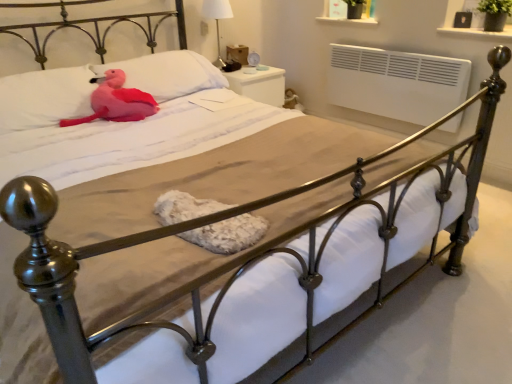
Question: From a real-world perspective, is matte pink pillow at upper left, which is the 1th pillow from right to left, beneath pink plush at upper left, which appears as the 1th pillow when viewed from the left?

Choices:
 (A) no
 (B) yes

Answer: (B)

Question: From the image's perspective, is matte pink pillow at upper left, which is the 1th pillow from right to left, under pink plush at upper left, which appears as the 1th pillow when viewed from the left?

Choices:
 (A) yes
 (B) no

Answer: (B)

Question: From the image's perspective, would you say matte pink pillow at upper left, which is the 1th pillow from right to left, is positioned over pink plush at upper left, the 2th pillow when ordered from right to left?

Choices:
 (A) no
 (B) yes

Answer: (B)

Question: Could you tell me if matte pink pillow at upper left, which is the 1th pillow from right to left, is facing pink plush at upper left, the 2th pillow when ordered from right to left?

Choices:
 (A) no
 (B) yes

Answer: (A)

Question: Can you confirm if matte pink pillow at upper left, acting as the 2th pillow starting from the left, is wider than pink plush at upper left, the 2th pillow when ordered from right to left?

Choices:
 (A) no
 (B) yes

Answer: (B)

Question: From a real-world perspective, is pink plush toy at upper left physically located above or below pink plush at upper left, which appears as the 1th pillow when viewed from the left?

Choices:
 (A) below
 (B) above

Answer: (A)

Question: Is pink plush toy at upper left taller or shorter than pink plush at upper left, which appears as the 1th pillow when viewed from the left?

Choices:
 (A) short
 (B) tall

Answer: (A)

Question: Is pink plush toy at upper left spatially inside pink plush at upper left, which appears as the 1th pillow when viewed from the left, or outside of it?

Choices:
 (A) outside
 (B) inside

Answer: (B)

Question: Is pink plush toy at upper left in front of or behind pink plush at upper left, the 2th pillow when ordered from right to left, in the image?

Choices:
 (A) behind
 (B) front

Answer: (A)

Question: Is white fabric lampshade at upper center wider or thinner than white glossy nightstand at upper right?

Choices:
 (A) wide
 (B) thin

Answer: (B)

Question: From their relative heights in the image, would you say white fabric lampshade at upper center is taller or shorter than white glossy nightstand at upper right?

Choices:
 (A) short
 (B) tall

Answer: (B)

Question: In terms of size, does white fabric lampshade at upper center appear bigger or smaller than white glossy nightstand at upper right?

Choices:
 (A) small
 (B) big

Answer: (A)

Question: In the image, is white fabric lampshade at upper center on the left side or the right side of white glossy nightstand at upper right?

Choices:
 (A) right
 (B) left

Answer: (B)

Question: Relative to white fabric lampshade at upper center, is pink plush toy at upper left in front or behind?

Choices:
 (A) behind
 (B) front

Answer: (B)

Question: From the image's perspective, relative to white fabric lampshade at upper center, is pink plush toy at upper left above or below?

Choices:
 (A) above
 (B) below

Answer: (B)